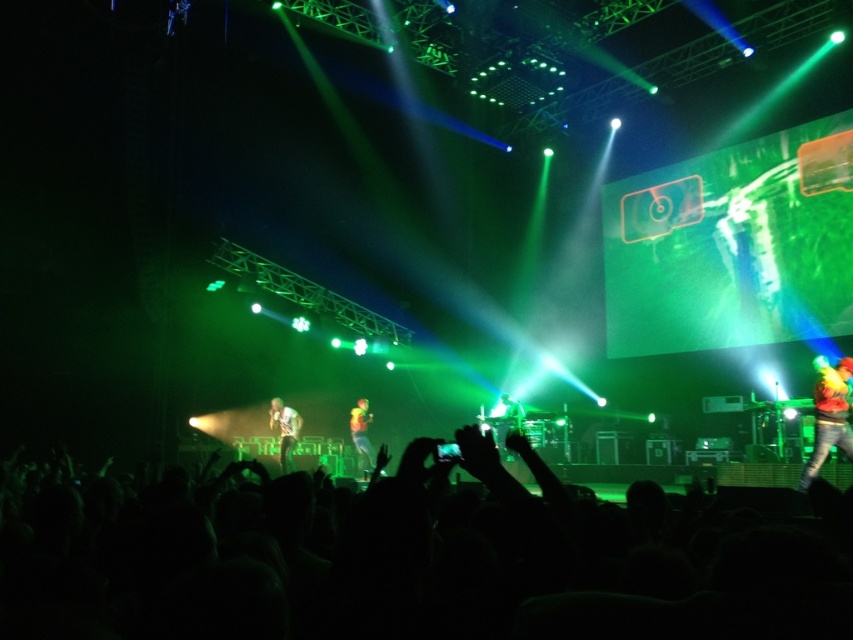
You are a stagehand who needs to adjust the lighting to focus on the shiny silver microphone at center and the shiny yellow jacket at center. Which object requires a narrower light beam to highlight it properly?

The shiny silver microphone at center requires a narrower light beam because it occupies less space than the shiny yellow jacket at center.

You are a stagehand trying to retrieve the shiny silver microphone at center and the shiny yellow jacket at center. Which object is positioned higher from the ground?

The shiny silver microphone at center is above the shiny yellow jacket at center, so the shiny silver microphone at center is higher from the ground.